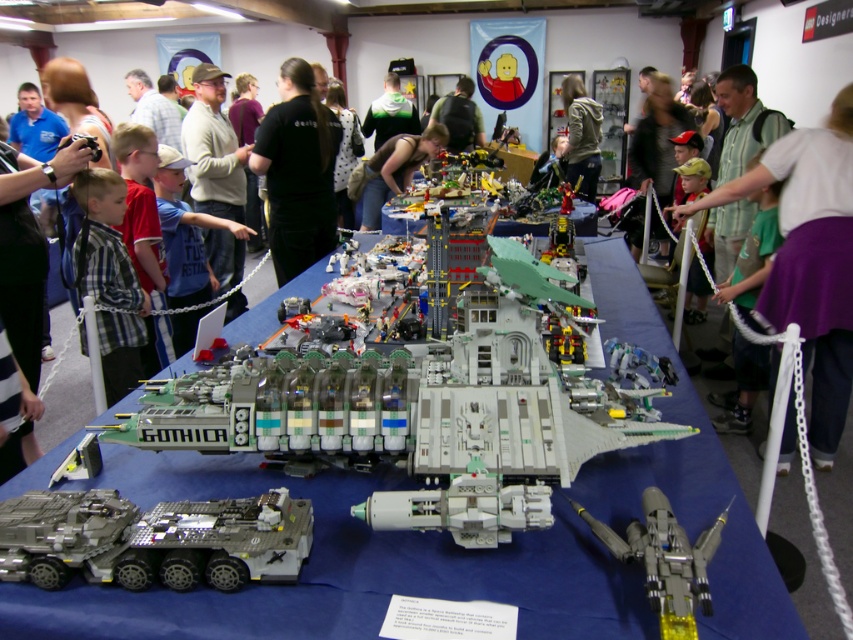
You are a security guard at the event and need to ensure that the shiny silver jet at center and the matte black shirt at center are kept at least 4 meters apart for safety. Based on the image, are they currently meeting this requirement?

The distance between the shiny silver jet at center and the matte black shirt at center is 4.37 meters, which exceeds the required 4 meters. Therefore, they are currently meeting the safety requirement.